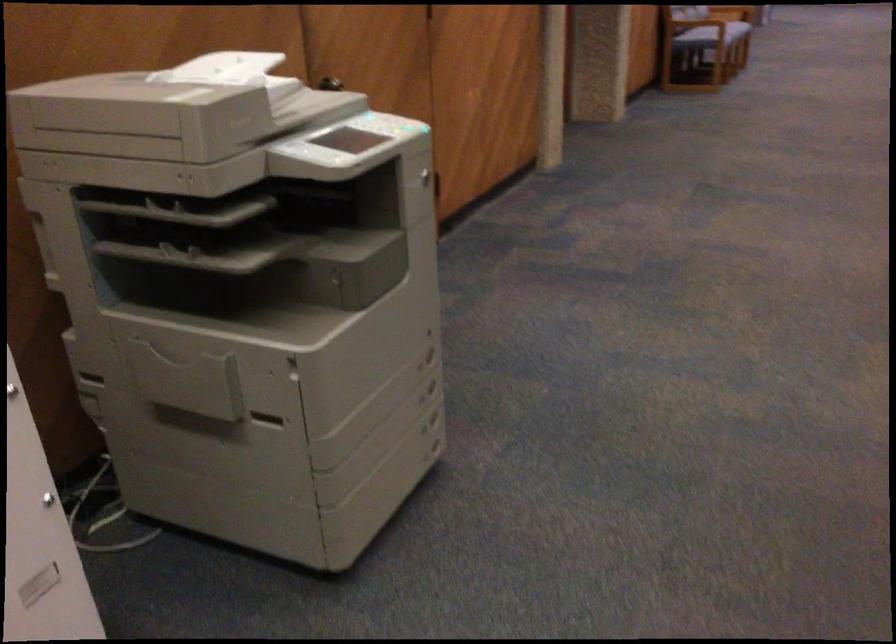
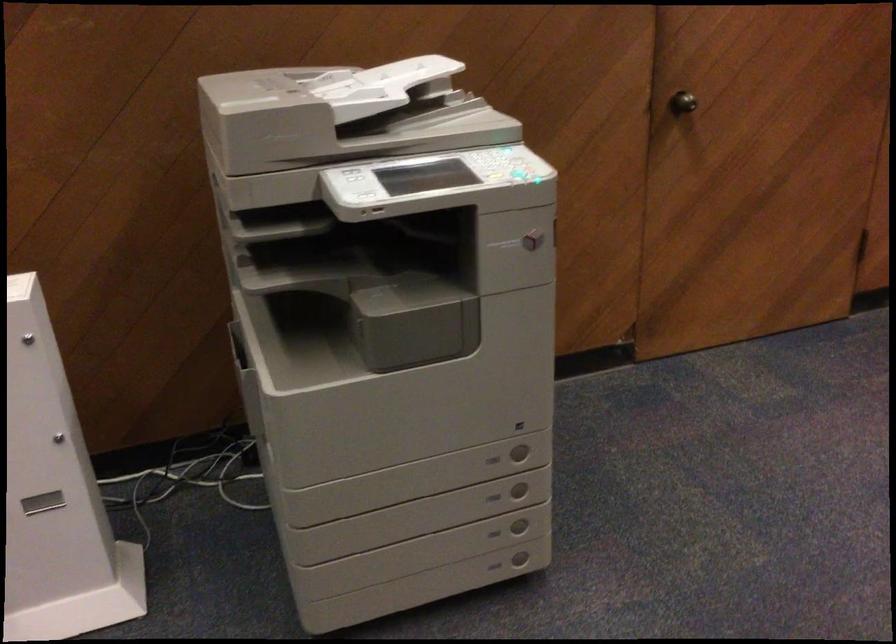
Where in the second image is the point corresponding to point 433,359 from the first image?

(519, 451)